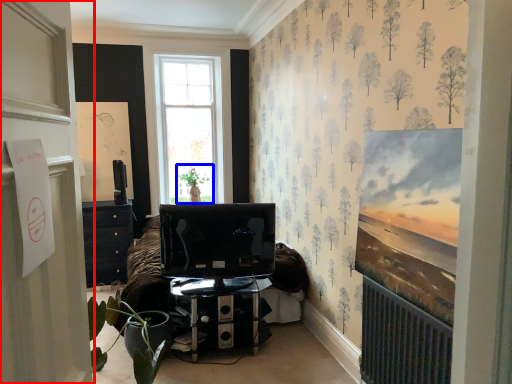
Question: Among these objects, which one is farthest to the camera, door (highlighted by a red box) or plant (highlighted by a blue box)?

Choices:
 (A) door
 (B) plant

Answer: (B)